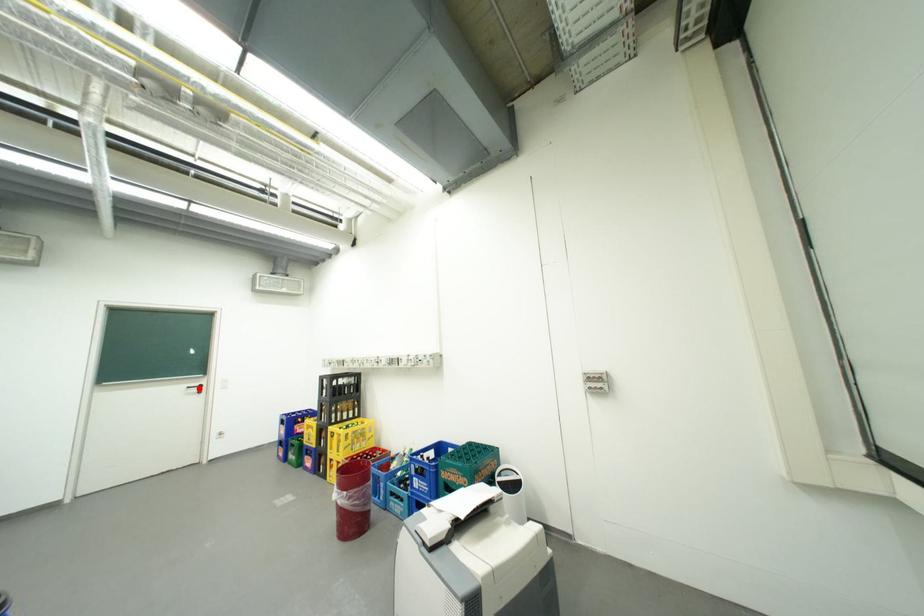
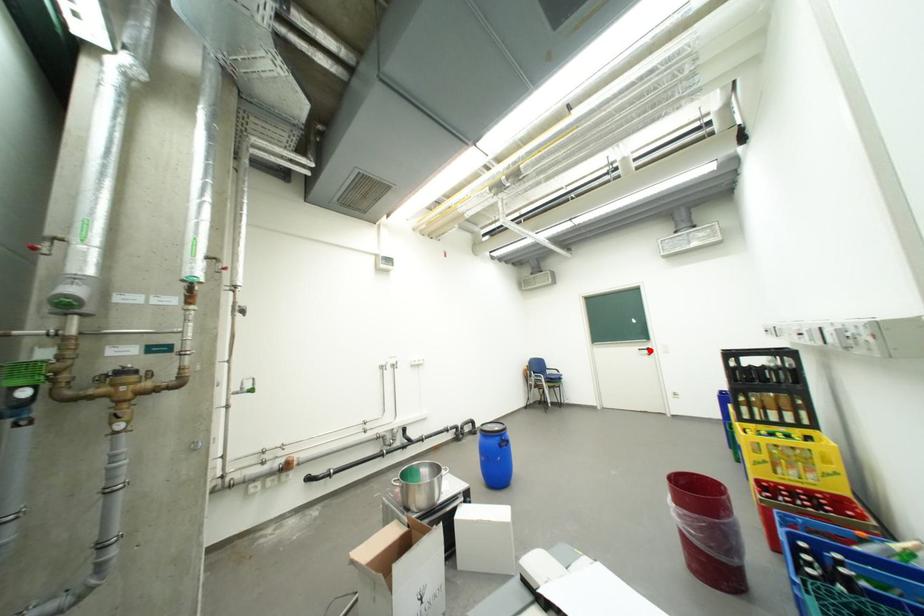
I am providing you with two images of the same scene from different viewpoints. A red point is marked on the first image and another point is marked on the second image. Is the red point in image1 aligned with the point shown in image2?

Yes